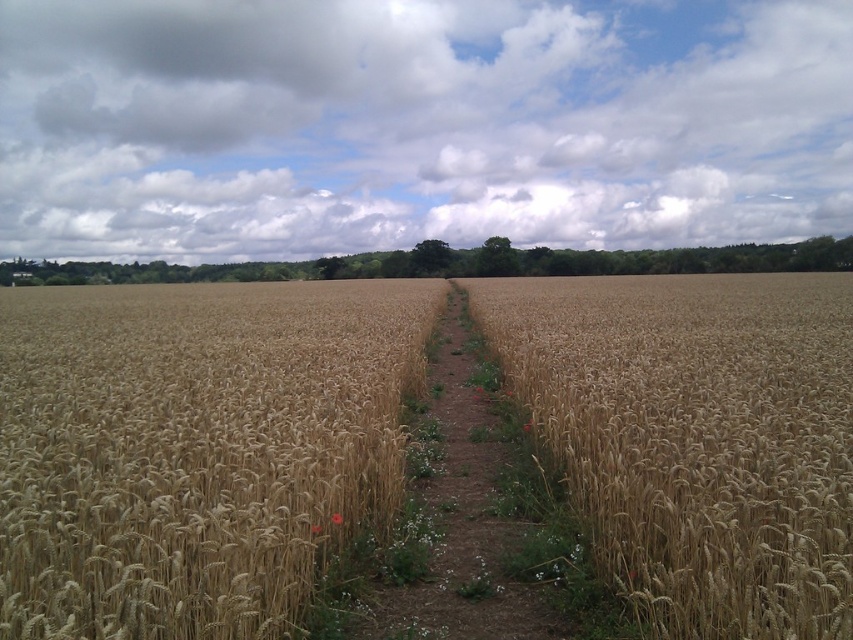
Question: Can you confirm if golden wheat at center is positioned below golden matte wheat at center?

Choices:
 (A) yes
 (B) no

Answer: (A)

Question: Which point is closer to the camera?

Choices:
 (A) golden wheat at center
 (B) golden matte wheat at center
 (C) brown dirt path at center

Answer: (A)

Question: Can you confirm if golden matte wheat at center is positioned to the left of brown dirt path at center?

Choices:
 (A) yes
 (B) no

Answer: (B)

Question: Which of the following is the closest to the observer?

Choices:
 (A) (515, 458)
 (B) (351, 484)
 (C) (740, 448)

Answer: (C)

Question: Can you confirm if golden matte wheat at center is smaller than brown dirt path at center?

Choices:
 (A) yes
 (B) no

Answer: (B)

Question: Which of the following is the closest to the observer?

Choices:
 (A) (608, 380)
 (B) (152, 467)

Answer: (B)